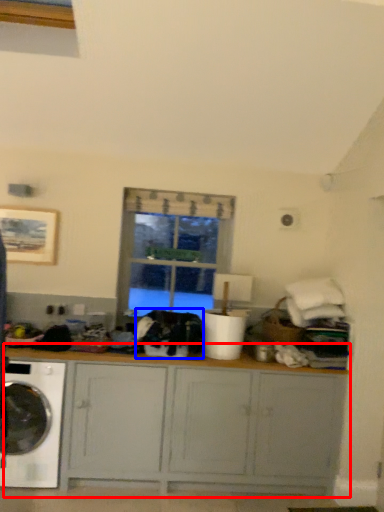
Question: Among these objects, which one is farthest to the camera, cabinetry (highlighted by a red box) or clothing (highlighted by a blue box)?

Choices:
 (A) cabinetry
 (B) clothing

Answer: (B)